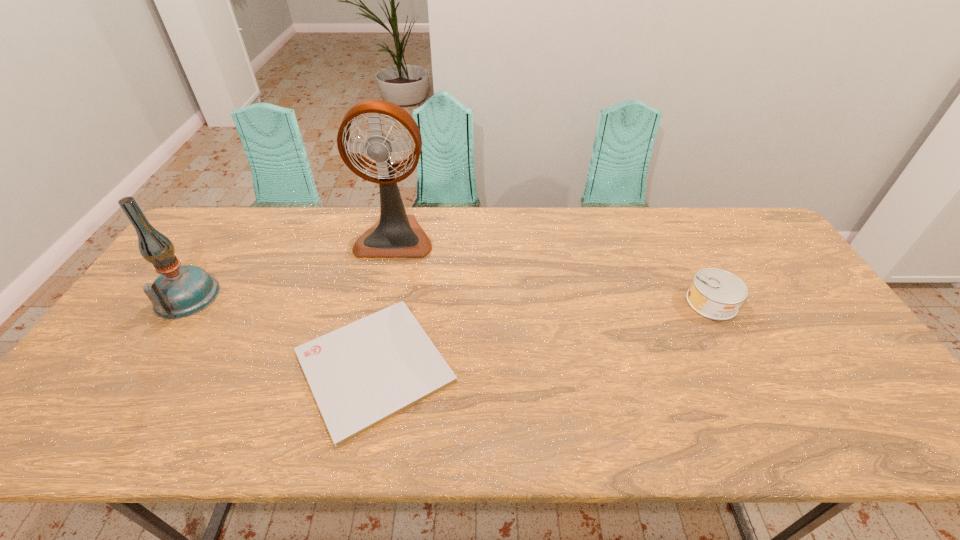
Where is `vacant area situated 0.330m on the left of the clipboard`? This screenshot has width=960, height=540. vacant area situated 0.330m on the left of the clipboard is located at coordinates pyautogui.click(x=157, y=366).

At what (x,y) coordinates should I click in order to perform the action: click on object situated at the far edge. Please return your answer as a coordinate pair (x, y). The image size is (960, 540). Looking at the image, I should click on (396, 234).

Identify the location of object present at the near edge. (364, 373).

This screenshot has height=540, width=960. In order to click on object that is at the left edge in this screenshot , I will do `click(180, 291)`.

At what (x,y) coordinates should I click in order to perform the action: click on free space at the far edge of the desktop. Please return your answer as a coordinate pair (x, y). Looking at the image, I should click on (610, 218).

In the image, there is a desktop. Where is `vacant space at the far left corner`? The image size is (960, 540). vacant space at the far left corner is located at coordinates (212, 237).

Identify the location of vacant space at the far right corner of the desktop. The width and height of the screenshot is (960, 540). (738, 220).

Where is `vacant space that's between the fan and the shortest object`? This screenshot has height=540, width=960. vacant space that's between the fan and the shortest object is located at coordinates (385, 301).

Locate an element on the screen. This screenshot has width=960, height=540. free point between the can and the shortest object is located at coordinates (543, 334).

Identify the location of free space between the farthest object and the rightmost object. (553, 269).